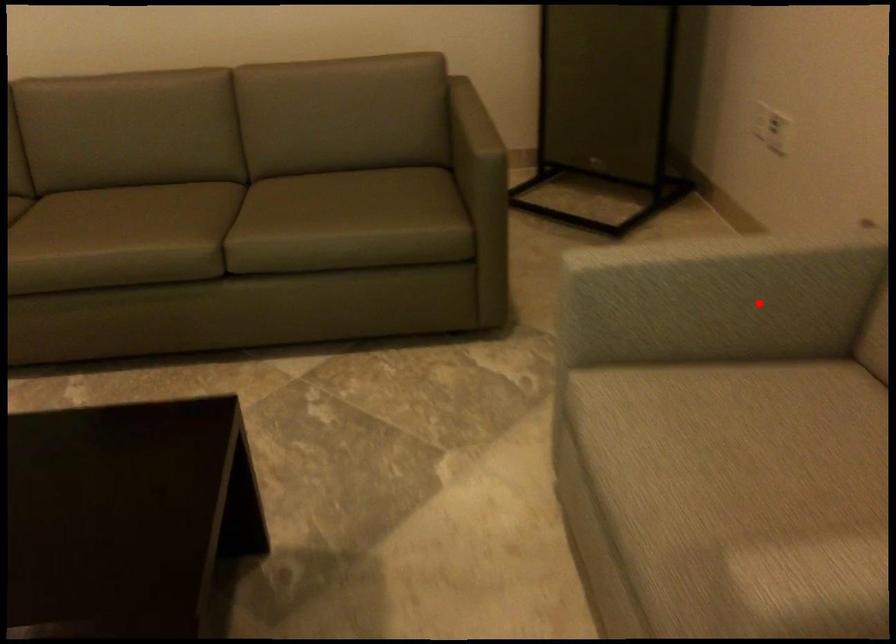
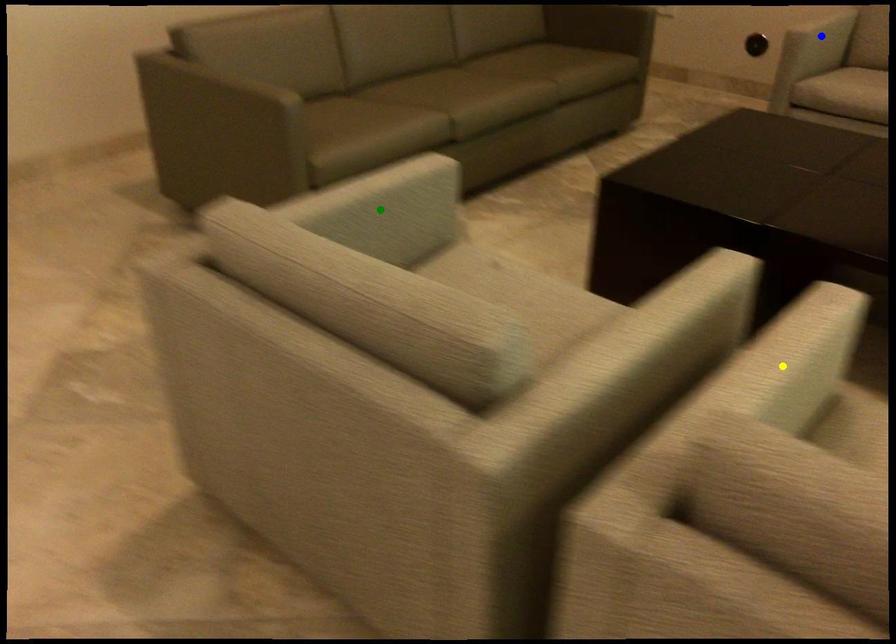
Question: I am providing you with two images of the same scene from different viewpoints. A red point is marked on the first image. You are given multiple points on the second image. Which mark in image 2 goes with the point in image 1?

Choices:
 (A) yellow point
 (B) green point
 (C) blue point

Answer: (C)